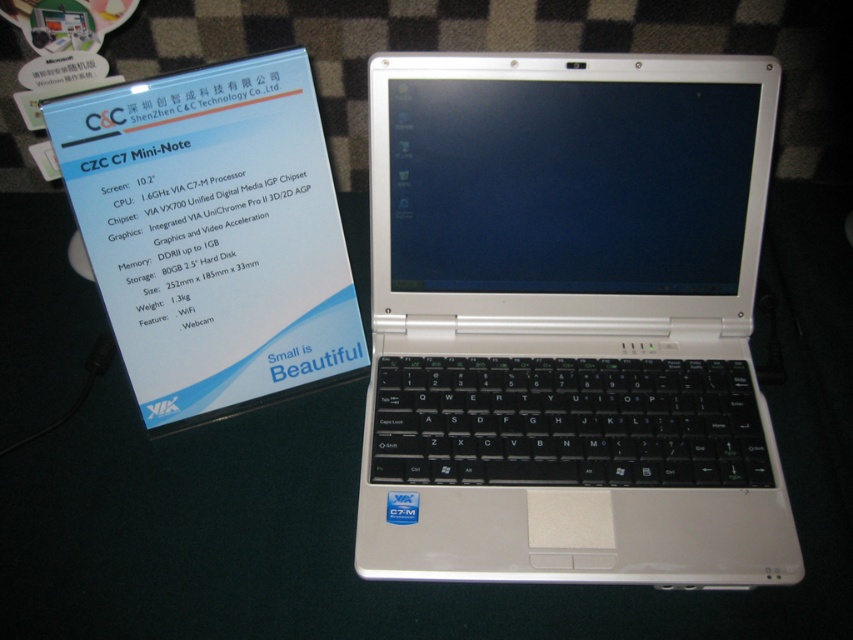
Where is the white plastic laptop at center located in the image?

The white plastic laptop at center is located at point (567, 321) in the image.